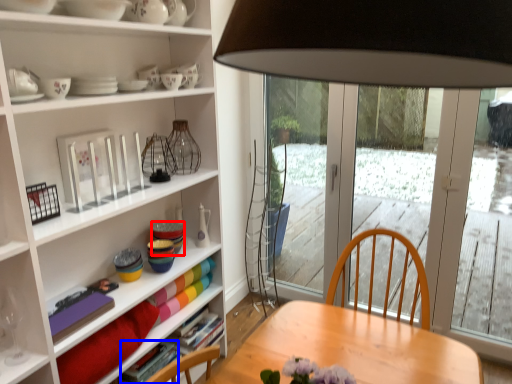
Question: Which point is further to the camera, tableware (highlighted by a red box) or book (highlighted by a blue box)?

Choices:
 (A) tableware
 (B) book

Answer: (A)